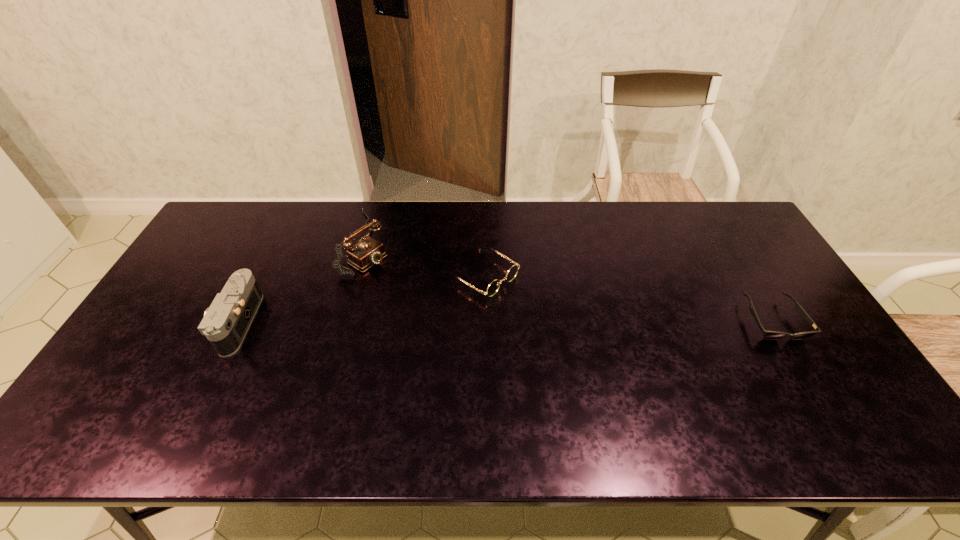
In order to click on vacant space at the far edge of the desktop in this screenshot , I will do pyautogui.click(x=405, y=237).

The image size is (960, 540). Find the location of `free space at the near edge`. free space at the near edge is located at coordinates (338, 404).

The height and width of the screenshot is (540, 960). Identify the location of vacant space at the left edge. (206, 247).

The image size is (960, 540). In the image, there is a desktop. Find the location of `free region at the far left corner`. free region at the far left corner is located at coordinates (222, 235).

The image size is (960, 540). In the image, there is a desktop. What are the coordinates of `vacant space at the far right corner` in the screenshot? It's located at (753, 242).

The width and height of the screenshot is (960, 540). Find the location of `unoccupied position between the telephone and the spectacles`. unoccupied position between the telephone and the spectacles is located at coordinates (425, 259).

Image resolution: width=960 pixels, height=540 pixels. What are the coordinates of `free spot between the shortest object and the second object from left to right` in the screenshot? It's located at (570, 281).

The image size is (960, 540). Find the location of `free space between the spectacles and the rightmost object`. free space between the spectacles and the rightmost object is located at coordinates (628, 298).

At what (x,y) coordinates should I click in order to perform the action: click on unoccupied position between the third object from right to left and the spectacles. Please return your answer as a coordinate pair (x, y). The height and width of the screenshot is (540, 960). Looking at the image, I should click on (425, 259).

Where is `unoccupied area between the third shortest object and the spectacles`? unoccupied area between the third shortest object and the spectacles is located at coordinates (360, 299).